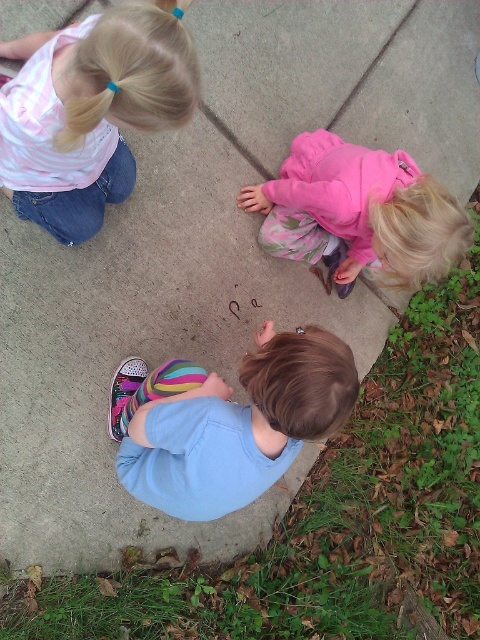
You are a photographer taking a picture of the striped cotton shirt at upper left and the pink fleece jacket at lower right. Which one should you focus on if you want to capture the larger object in the frame?

The pink fleece jacket at lower right is larger than the striped cotton shirt at upper left, so you should focus on the pink fleece jacket at lower right to capture the larger object in the frame.

You are standing at the edge of the concrete area and want to hand a drawing tool to the striped cotton shirt at upper left. Considering the distance, can you reach them without moving closer?

The striped cotton shirt at upper left is 3.98 feet away from the viewer. Since the average human arm length is about 2.5 feet, you cannot reach them without moving closer.

You are observing three children from above. Which child is wearing the blue cotton shirt at lower center, and is it positioned to the left or right of the pink fleece jacket at lower right?

The blue cotton shirt at lower center is positioned to the left of the pink fleece jacket at lower right.